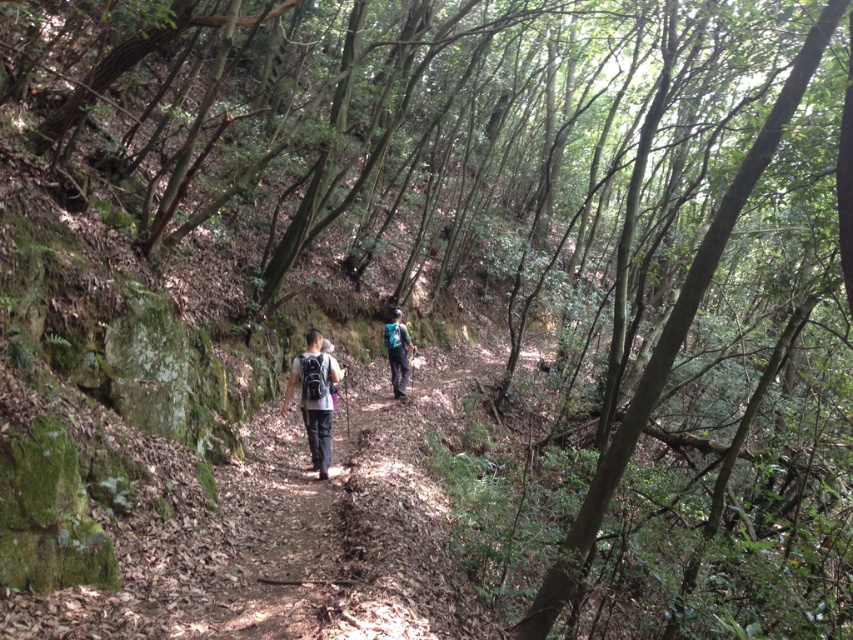
Question: Which point appears closest to the camera in this image?

Choices:
 (A) (412, 346)
 (B) (323, 397)

Answer: (B)

Question: Is matte black backpack at center bigger than blue fabric backpack at center?

Choices:
 (A) yes
 (B) no

Answer: (A)

Question: Which object is farther from the camera taking this photo?

Choices:
 (A) blue fabric backpack at center
 (B) matte black backpack at center

Answer: (A)

Question: Does matte black backpack at center appear over blue fabric backpack at center?

Choices:
 (A) yes
 (B) no

Answer: (B)

Question: Does matte black backpack at center appear over blue fabric backpack at center?

Choices:
 (A) no
 (B) yes

Answer: (A)